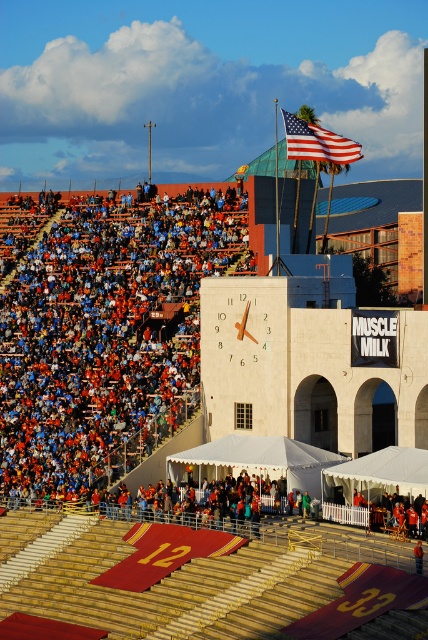
Question: Is orange fabric seats at upper left above american flag at upper center?

Choices:
 (A) yes
 (B) no

Answer: (B)

Question: Can you confirm if orange fabric seats at upper left is thinner than american flag at upper center?

Choices:
 (A) yes
 (B) no

Answer: (B)

Question: Which point is closer to the camera?

Choices:
 (A) (165, 276)
 (B) (335, 138)

Answer: (B)

Question: Does orange fabric seats at upper left have a larger size compared to american flag at upper center?

Choices:
 (A) yes
 (B) no

Answer: (B)

Question: Which object appears farthest from the camera in this image?

Choices:
 (A) american flag at upper center
 (B) orange fabric seats at upper left

Answer: (A)